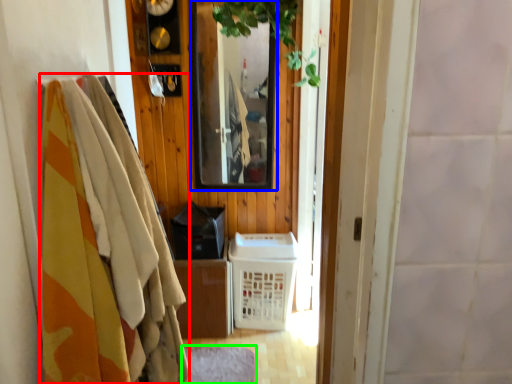
Question: Estimate the real-world distances between objects in this image. Which object is farther from clothing (highlighted by a red box), mirror (highlighted by a blue box) or mat (highlighted by a green box)?

Choices:
 (A) mirror
 (B) mat

Answer: (A)